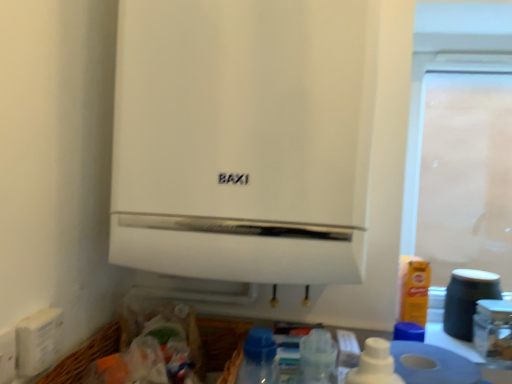
Question: Can you see matte black jar at lower right touching transparent plastic screen door at upper right?

Choices:
 (A) no
 (B) yes

Answer: (A)

Question: From the image's perspective, is matte black jar at lower right beneath transparent plastic screen door at upper right?

Choices:
 (A) no
 (B) yes

Answer: (B)

Question: Is matte black jar at lower right at the right side of transparent plastic screen door at upper right?

Choices:
 (A) yes
 (B) no

Answer: (A)

Question: Can you confirm if matte black jar at lower right is bigger than transparent plastic screen door at upper right?

Choices:
 (A) no
 (B) yes

Answer: (A)

Question: Is matte black jar at lower right positioned beyond the bounds of transparent plastic screen door at upper right?

Choices:
 (A) yes
 (B) no

Answer: (A)

Question: Choose the correct answer: Is transparent plastic screen door at upper right inside white matte boiler at center or outside it?

Choices:
 (A) outside
 (B) inside

Answer: (A)

Question: Is transparent plastic screen door at upper right to the left or to the right of white matte boiler at center in the image?

Choices:
 (A) right
 (B) left

Answer: (A)

Question: Relative to white matte boiler at center, is transparent plastic screen door at upper right in front or behind?

Choices:
 (A) behind
 (B) front

Answer: (A)

Question: Is point (486, 77) closer or farther from the camera than point (267, 81)?

Choices:
 (A) closer
 (B) farther

Answer: (B)

Question: Relative to white matte boiler at center, is white matte toilet paper at lower right in front or behind?

Choices:
 (A) behind
 (B) front

Answer: (A)

Question: In terms of width, does white matte toilet paper at lower right look wider or thinner when compared to white matte boiler at center?

Choices:
 (A) wide
 (B) thin

Answer: (B)

Question: From the image's perspective, is white matte toilet paper at lower right located above or below white matte boiler at center?

Choices:
 (A) above
 (B) below

Answer: (B)

Question: From a real-world perspective, is white matte toilet paper at lower right physically located above or below white matte boiler at center?

Choices:
 (A) above
 (B) below

Answer: (B)

Question: Considering the relative positions of white matte boiler at center and white plastic electric outlet at lower left in the image provided, is white matte boiler at center to the left or to the right of white plastic electric outlet at lower left?

Choices:
 (A) right
 (B) left

Answer: (A)

Question: Does point [x=224, y=124] appear closer or farther from the camera than point [x=11, y=347]?

Choices:
 (A) closer
 (B) farther

Answer: (B)